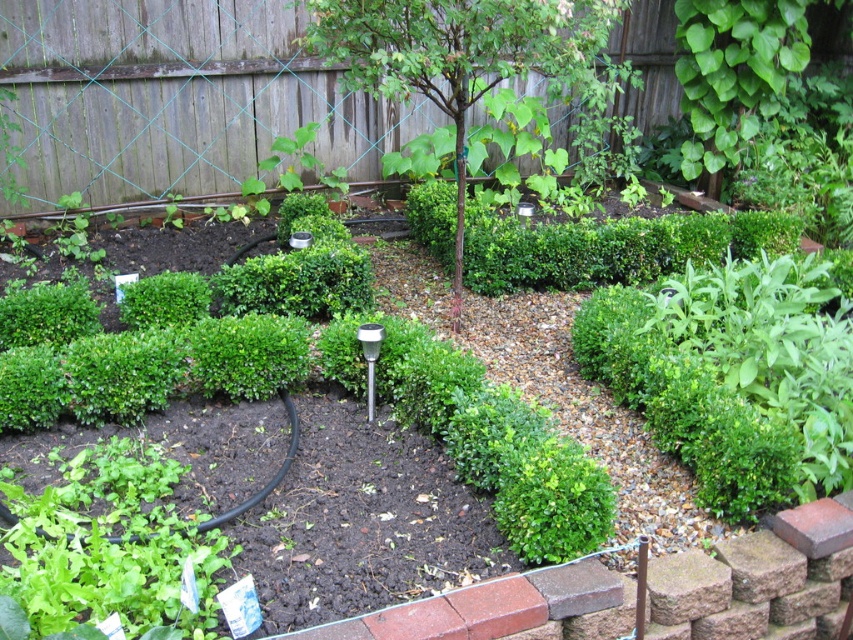
You are standing in the garden and want to reach a specific point marked at coordinates point (44, 140). If you can walk 5 meters in 1 minute, how long will it take you to reach that point?

The distance of point (44, 140) from viewer is 4.36 meters. At a walking speed of 5 meters per minute, it would take approximately 0.87 minutes, which is about 52 seconds, to reach the point.

You are a gardener planning to plant a new flower bed between the wooden fence at upper center and the green leafy tree at center. Based on their positions, which object is directly above the other?

The wooden fence at upper center is positioned over the green leafy tree at center, so the wooden fence at upper center is directly above the green leafy tree at center.

You are a gardener who needs to install a new sprinkler system between the wooden fence at upper center and the green leafy tree at center. The sprinkler requires a minimum of 5 feet of space to function properly. Based on the garden layout, will the available space between these two objects be sufficient for the sprinkler installation?

The distance between the wooden fence at upper center and the green leafy tree at center is 6.16 feet, which exceeds the required 5 feet. Therefore, the available space is sufficient for the sprinkler installation.